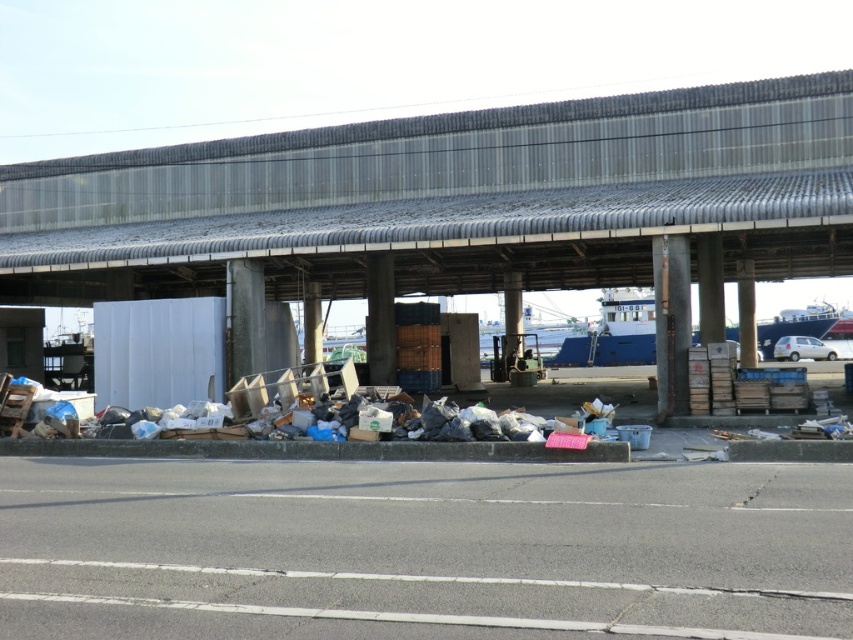
Question: Does metallic gray overpass at upper center have a lesser width compared to white glossy car at right?

Choices:
 (A) no
 (B) yes

Answer: (A)

Question: Which point is farther from the camera taking this photo?

Choices:
 (A) (833, 353)
 (B) (393, 177)

Answer: (A)

Question: Can you confirm if metallic gray overpass at upper center is positioned below white glossy car at right?

Choices:
 (A) yes
 (B) no

Answer: (B)

Question: Can you confirm if metallic gray overpass at upper center is positioned to the right of white glossy car at right?

Choices:
 (A) yes
 (B) no

Answer: (B)

Question: Which of the following is the farthest from the observer?

Choices:
 (A) (809, 349)
 (B) (709, 120)

Answer: (A)